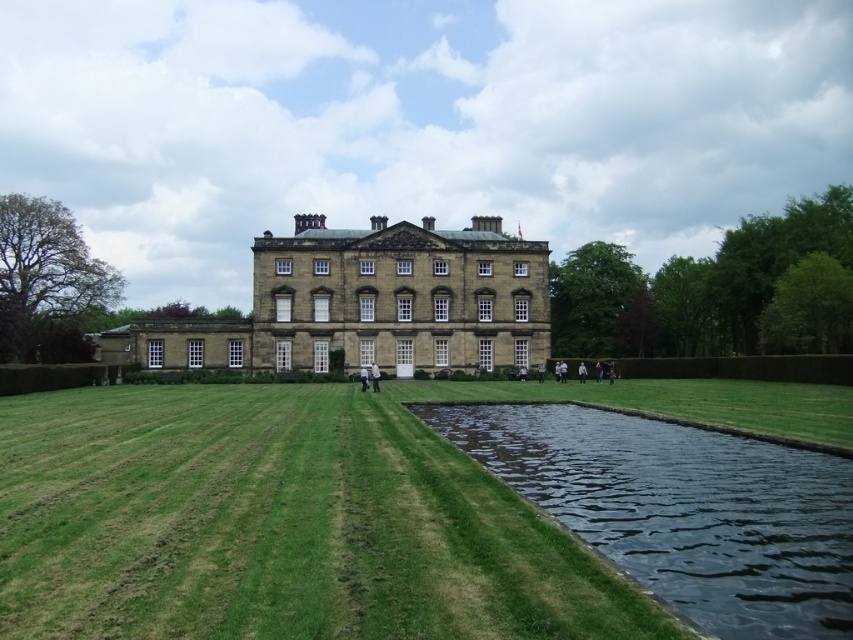
You are standing on the lawn and want to walk to the dark reflective water at lower right. Which direction should you head towards from the green grass at center?

You should head towards the right side from the green grass at center to reach the dark reflective water at lower right since the green grass at center is positioned on the left side of dark reflective water at lower right.

You are standing on the lawn in front of the historic building and want to find the dark reflective water at lower right. According to the coordinates provided, where should you look relative to your position?

You should look towards the lower right direction, specifically at the coordinates point at (683, 509), to find the dark reflective water at lower right.